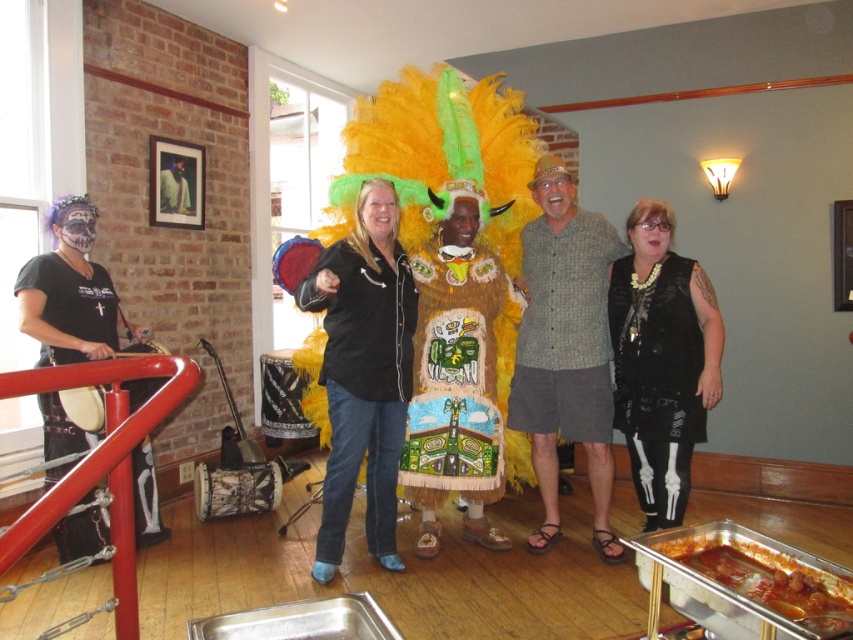
Is gray textured shirt at center below beige textured fabric at center?

Incorrect, gray textured shirt at center is not positioned below beige textured fabric at center.

Is point (599, 246) farther from camera compared to point (438, 497)?

Yes, point (599, 246) is farther from viewer.

Identify the location of gray textured shirt at center. (566, 348).

Is point (654, 417) positioned behind point (663, 552)?

Yes, point (654, 417) is behind point (663, 552).

Is black velvet vest at center smaller than shiny silver tray at lower right?

Actually, black velvet vest at center might be larger than shiny silver tray at lower right.

Who is more forward, (624, 353) or (810, 589)?

Point (810, 589)

Locate an element on the screen. This screenshot has width=853, height=640. black velvet vest at center is located at coordinates (660, 360).

Describe the element at coordinates (566, 348) in the screenshot. I see `gray textured shirt at center` at that location.

Measure the distance between gray textured shirt at center and camera.

10.70 feet

At what (x,y) coordinates should I click in order to perform the action: click on gray textured shirt at center. Please return your answer as a coordinate pair (x, y). Looking at the image, I should click on (566, 348).